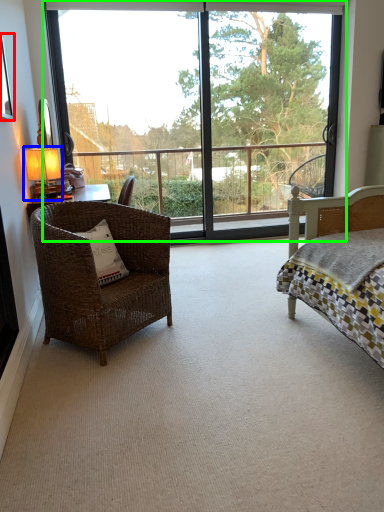
Question: Based on their relative distances, which object is farther from picture frame (highlighted by a red box)? Choose from table lamp (highlighted by a blue box) and window (highlighted by a green box).

Choices:
 (A) table lamp
 (B) window

Answer: (B)